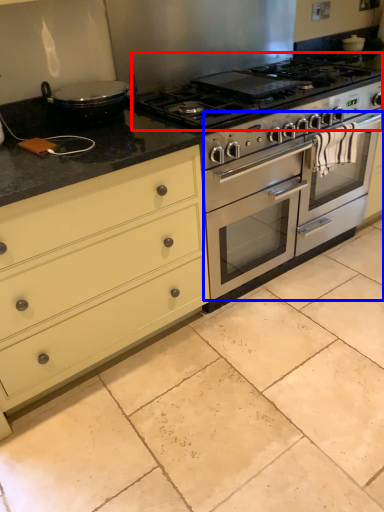
Question: Which of the following is the farthest to the observer, gas stove (highlighted by a red box) or oven (highlighted by a blue box)?

Choices:
 (A) gas stove
 (B) oven

Answer: (B)